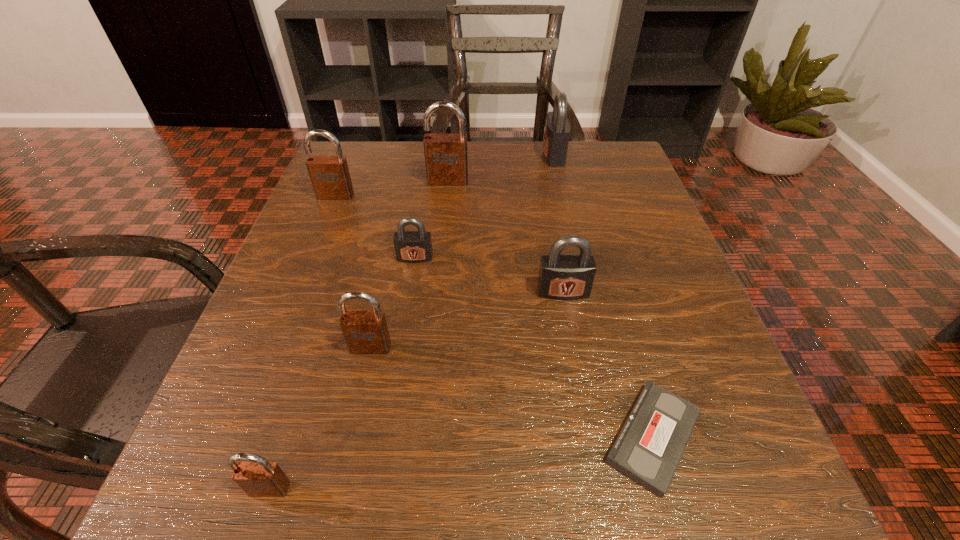
The image size is (960, 540). In order to click on free region located 0.120m on the front-facing side of the third farthest brown padlock in this screenshot , I will do `click(352, 431)`.

This screenshot has width=960, height=540. What are the coordinates of `free space located 0.050m on the front of the third nearest padlock near the keyhole` in the screenshot? It's located at [569, 325].

You are a GUI agent. You are given a task and a screenshot of the screen. Output one action in this format:
    pyautogui.click(x=<x>, y=<y>)
    Task: Click on the vacant area situated 0.110m on the front of the smallest gray padlock near the keyhole
    Image resolution: width=960 pixels, height=540 pixels.
    Given the screenshot: What is the action you would take?
    pyautogui.click(x=407, y=310)

The height and width of the screenshot is (540, 960). What are the coordinates of `vacant space located on the back of the videotape` in the screenshot? It's located at (601, 256).

Where is `padlock that is at the near edge`? The height and width of the screenshot is (540, 960). padlock that is at the near edge is located at coordinates (258, 478).

Image resolution: width=960 pixels, height=540 pixels. Identify the location of videotape that is at the near edge. (650, 445).

Image resolution: width=960 pixels, height=540 pixels. What are the coordinates of `padlock located at the right edge` in the screenshot? It's located at (557, 131).

The image size is (960, 540). What are the coordinates of `videotape at the right edge` in the screenshot? It's located at (650, 445).

The width and height of the screenshot is (960, 540). Identify the location of object that is positioned at the far left corner. click(x=330, y=177).

Locate an element on the screen. This screenshot has width=960, height=540. object that is at the near left corner is located at coordinates (258, 478).